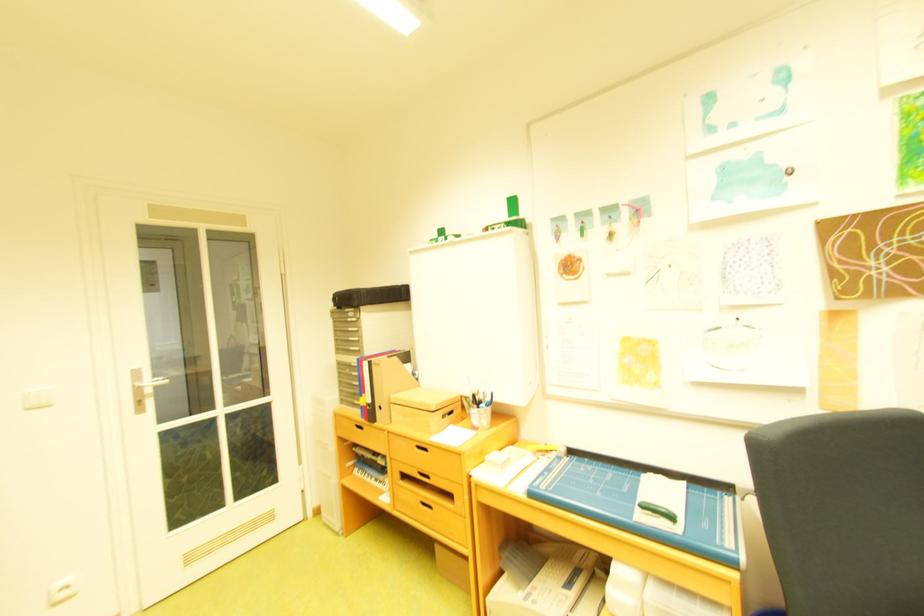
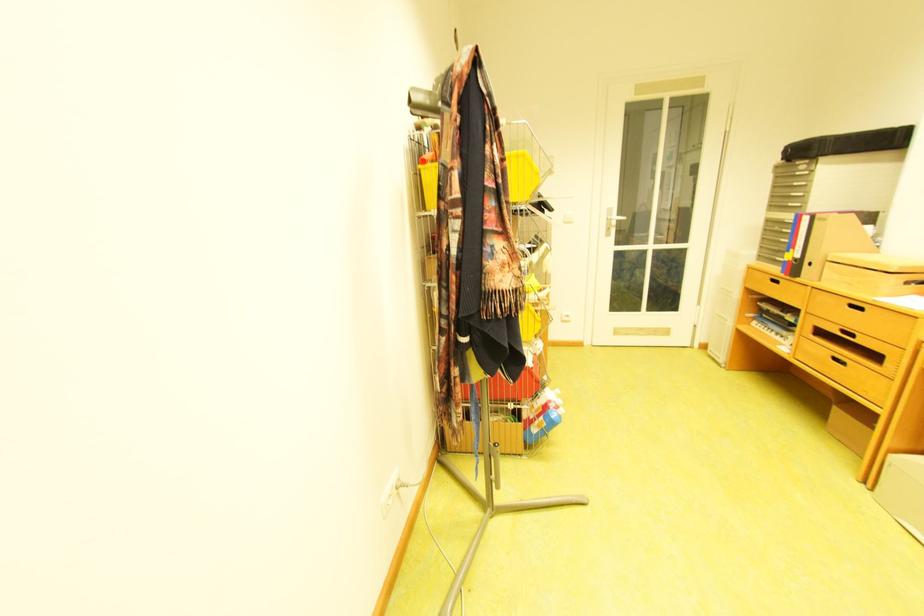
Locate, in the second image, the point that corresponds to point (368, 293) in the first image.

(832, 140)